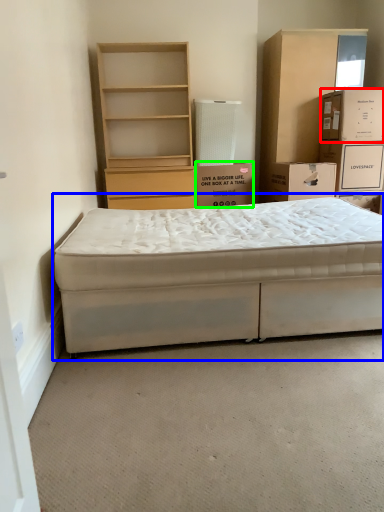
Question: Which object is the farthest from box (highlighted by a red box)? Choose among these: bed (highlighted by a blue box) or box (highlighted by a green box).

Choices:
 (A) bed
 (B) box

Answer: (A)